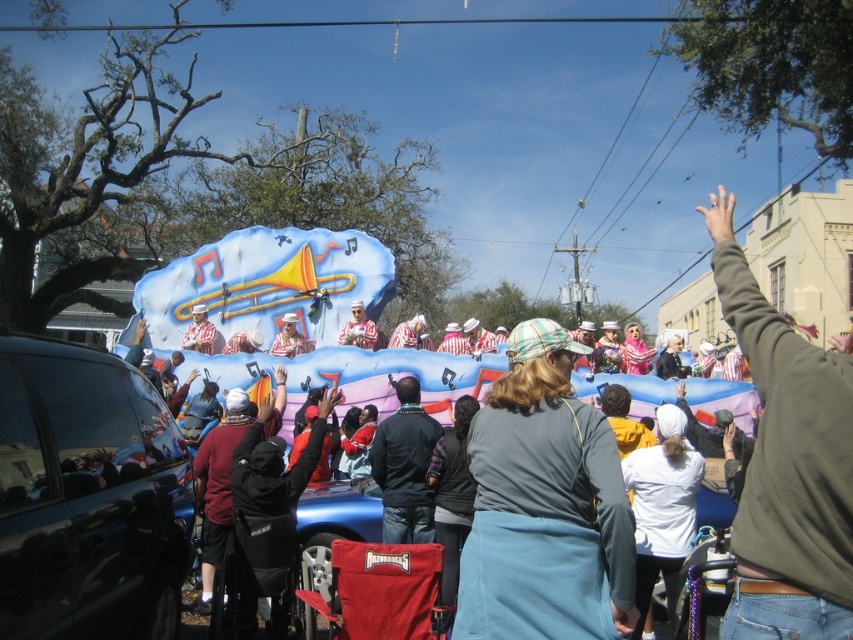
Can you confirm if shiny black car at lower left is thinner than dark blue jacket at center?

No.

Is the position of shiny black car at lower left more distant than that of dark blue jacket at center?

No, it is not.

Is point (16, 502) positioned in front of point (393, 486)?

Yes, point (16, 502) is closer to viewer.

Identify the location of shiny black car at lower left. The width and height of the screenshot is (853, 640). (86, 497).

Which is behind, point (250, 534) or point (657, 531)?

Point (657, 531)

Can you confirm if black fabric at center is taller than white matte jacket at center?

Correct, black fabric at center is much taller as white matte jacket at center.

Image resolution: width=853 pixels, height=640 pixels. Describe the element at coordinates (270, 513) in the screenshot. I see `black fabric at center` at that location.

Where is `black fabric at center`? The height and width of the screenshot is (640, 853). black fabric at center is located at coordinates (270, 513).

Is white matte jacket at center positioned at the back of matte white hat at center?

No, white matte jacket at center is in front of matte white hat at center.

Can you confirm if white matte jacket at center is positioned to the right of matte white hat at center?

Indeed, white matte jacket at center is positioned on the right side of matte white hat at center.

Between point (648, 570) and point (339, 337), which one is positioned in front?

Positioned in front is point (648, 570).

I want to click on white matte jacket at center, so click(662, 508).